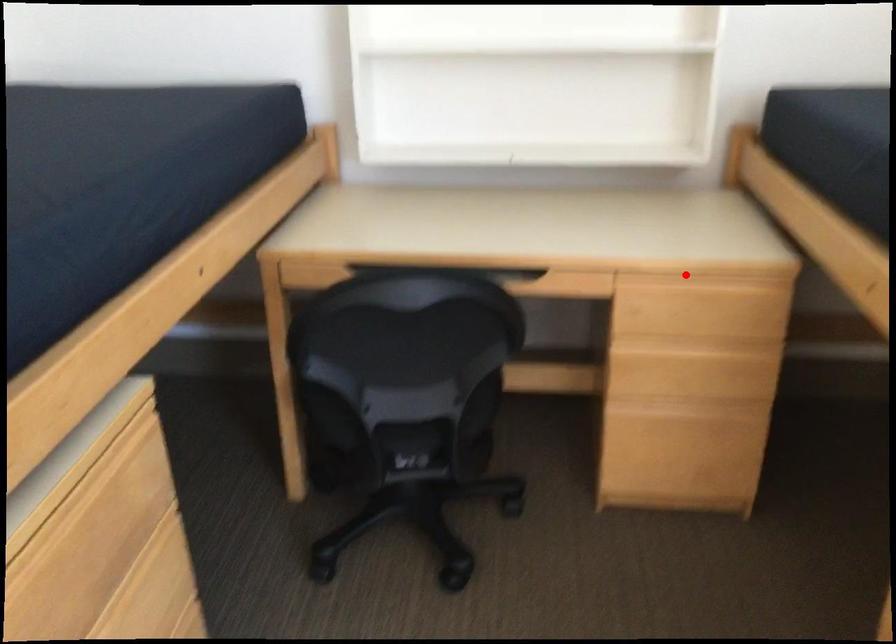
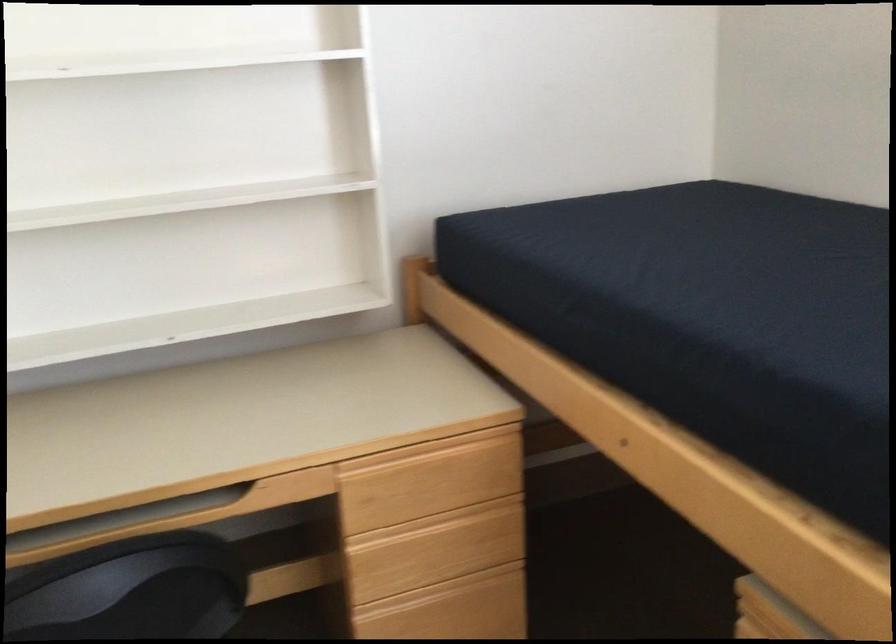
Question: I am providing you with two images of the same scene from different viewpoints. A red point is marked on the first image. At the location where the point appears in image 1, is it still visible in image 2?

Choices:
 (A) Yes
 (B) No

Answer: (A)